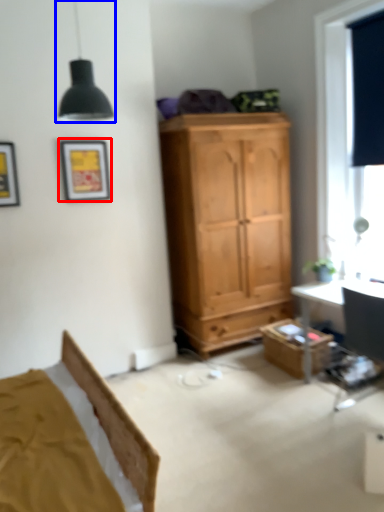
Question: Among these objects, which one is farthest to the camera, picture frame (highlighted by a red box) or light fixture (highlighted by a blue box)?

Choices:
 (A) picture frame
 (B) light fixture

Answer: (A)